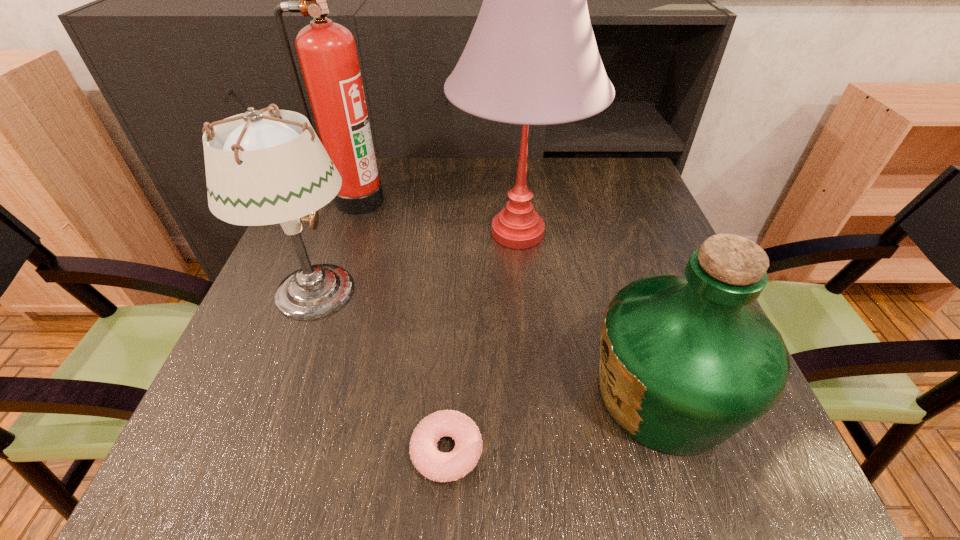
What are the coordinates of `object situated at the right edge` in the screenshot? It's located at (686, 362).

The image size is (960, 540). I want to click on object that is at the far left corner, so pyautogui.click(x=327, y=53).

The height and width of the screenshot is (540, 960). Find the location of `object that is at the near right corner`. object that is at the near right corner is located at coordinates (686, 362).

Locate an element on the screen. blank space at the far edge of the desktop is located at coordinates 495,201.

Where is `vacant region at the near edge of the desktop`? The width and height of the screenshot is (960, 540). vacant region at the near edge of the desktop is located at coordinates (445, 485).

This screenshot has width=960, height=540. Find the location of `vacant space at the left edge`. vacant space at the left edge is located at coordinates (264, 312).

Where is `free space at the right edge of the desktop`? The width and height of the screenshot is (960, 540). free space at the right edge of the desktop is located at coordinates (618, 292).

Where is `vacant region at the near left corner of the desktop`? This screenshot has height=540, width=960. vacant region at the near left corner of the desktop is located at coordinates (258, 467).

Find the location of a particular element. vacant space at the far right corner of the desktop is located at coordinates (641, 190).

Where is `free spot between the lampshade and the doughnut`? free spot between the lampshade and the doughnut is located at coordinates (381, 372).